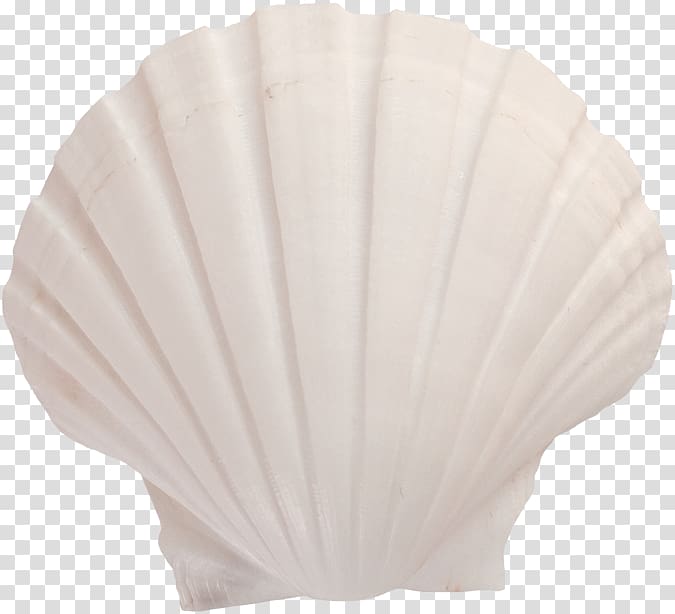
Identify the location of tile background above shell. pos(366,10).